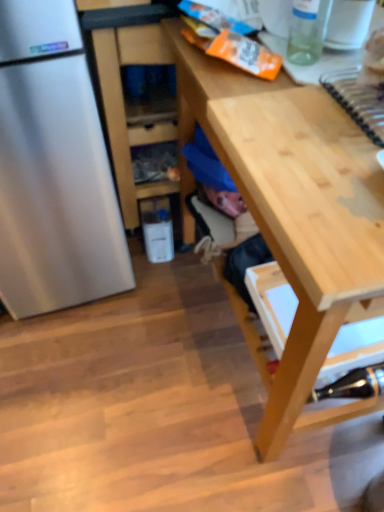
Question: Is transparent glass bottle at upper right, which ranks as the first bottle in top-to-bottom order, closer to camera compared to wooden cabinet at center?

Choices:
 (A) no
 (B) yes

Answer: (B)

Question: Considering the relative sizes of transparent glass bottle at upper right, which is the 1th bottle in left-to-right order, and wooden cabinet at center in the image provided, is transparent glass bottle at upper right, which is the 1th bottle in left-to-right order, smaller than wooden cabinet at center?

Choices:
 (A) yes
 (B) no

Answer: (A)

Question: Is transparent glass bottle at upper right, the 2th bottle positioned from the bottom, to the left of wooden cabinet at center from the viewer's perspective?

Choices:
 (A) yes
 (B) no

Answer: (B)

Question: From a real-world perspective, is transparent glass bottle at upper right, which is the 1th bottle in left-to-right order, below wooden cabinet at center?

Choices:
 (A) yes
 (B) no

Answer: (B)

Question: Is wooden cabinet at center a part of transparent glass bottle at upper right, acting as the 1th bottle starting from the front?

Choices:
 (A) no
 (B) yes

Answer: (A)

Question: Is transparent glass bottle at upper right, the 2th bottle positioned from the bottom, wider than wooden cabinet at center?

Choices:
 (A) no
 (B) yes

Answer: (A)

Question: Is metallic silver stapler at lower right, the 1th bottle viewed from the right, shorter than light wood desk at center?

Choices:
 (A) yes
 (B) no

Answer: (A)

Question: Considering the relative sizes of metallic silver stapler at lower right, which ranks as the 2th bottle in front-to-back order, and light wood desk at center in the image provided, is metallic silver stapler at lower right, which ranks as the 2th bottle in front-to-back order, wider than light wood desk at center?

Choices:
 (A) no
 (B) yes

Answer: (A)

Question: From the image's perspective, is metallic silver stapler at lower right, which ranks as the 2th bottle in front-to-back order, over light wood desk at center?

Choices:
 (A) yes
 (B) no

Answer: (B)

Question: Does metallic silver stapler at lower right, which is counted as the 1th bottle, starting from the back, have a larger size compared to light wood desk at center?

Choices:
 (A) no
 (B) yes

Answer: (A)

Question: Considering the relative positions of metallic silver stapler at lower right, acting as the 2th bottle starting from the left, and light wood desk at center in the image provided, is metallic silver stapler at lower right, acting as the 2th bottle starting from the left, behind light wood desk at center?

Choices:
 (A) no
 (B) yes

Answer: (B)

Question: From a real-world perspective, is metallic silver stapler at lower right, acting as the 2th bottle starting from the left, below light wood desk at center?

Choices:
 (A) no
 (B) yes

Answer: (B)

Question: Can you confirm if light wood desk at center is bigger than transparent glass bottle at upper right, the second bottle from the right?

Choices:
 (A) yes
 (B) no

Answer: (A)